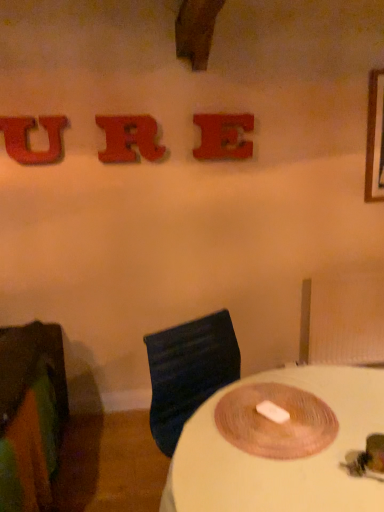
This screenshot has height=512, width=384. In order to click on vacant area on top of white matte table at center (from a real-world perspective) in this screenshot , I will do `click(279, 431)`.